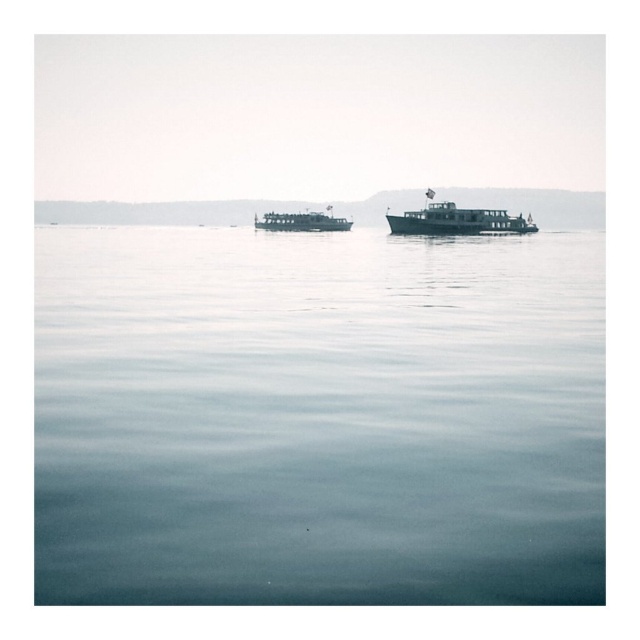
Is point (214, 289) positioned after point (440, 225)?

No, (214, 289) is closer to viewer.

Can you confirm if clear water at center is smaller than green matte boat at center?

Actually, clear water at center might be larger than green matte boat at center.

Is point (435, 524) positioned behind point (433, 228)?

No, it is not.

Identify the location of clear water at center. The width and height of the screenshot is (640, 640). (317, 417).

Does clear water at center appear on the left side of metallic silver ferry at center?

No, clear water at center is not to the left of metallic silver ferry at center.

Who is shorter, clear water at center or metallic silver ferry at center?

metallic silver ferry at center

You are a GUI agent. You are given a task and a screenshot of the screen. Output one action in this format:
    pyautogui.click(x=<x>, y=<y>)
    Task: Click on the clear water at center
    The image size is (640, 640).
    Given the screenshot: What is the action you would take?
    pyautogui.click(x=317, y=417)

Measure the distance between green matte boat at center and metallic silver ferry at center.

green matte boat at center and metallic silver ferry at center are 33.24 meters apart from each other.

Locate an element on the screen. The image size is (640, 640). green matte boat at center is located at coordinates (458, 220).